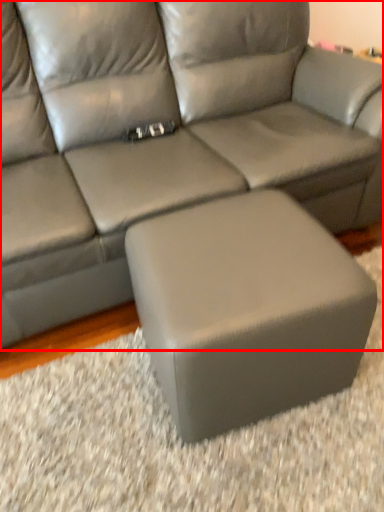
Question: Observing the image, what is the correct spatial positioning of studio couch (annotated by the red box) in reference to stool?

Choices:
 (A) right
 (B) left

Answer: (B)